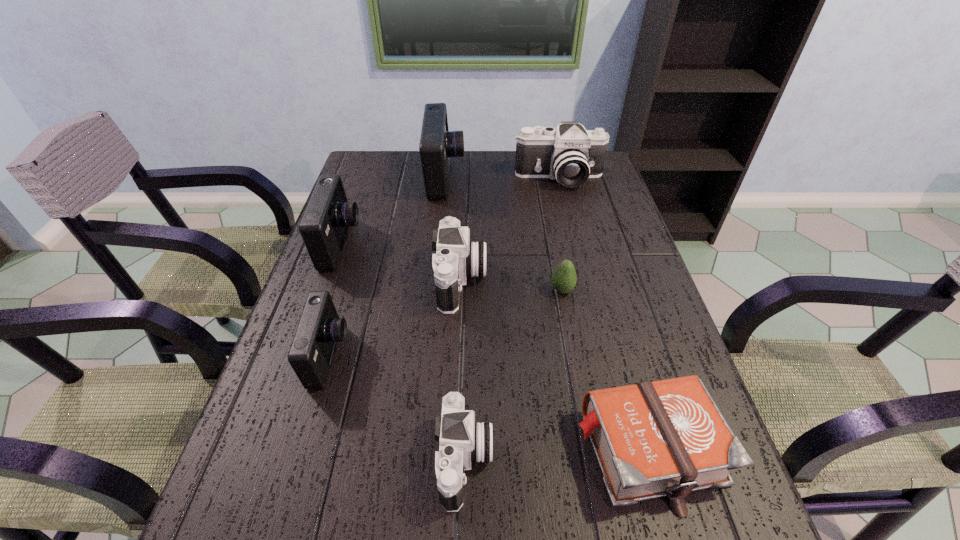
Locate an element on the screen. This screenshot has height=540, width=960. black camera that stands as the third closest to the avocado is located at coordinates (570, 154).

This screenshot has width=960, height=540. In order to click on free space that satisfies the following two spatial constraints: 1. on the front side of the rightmost camera; 2. on the front-facing side of the second smallest blue camera in this screenshot , I will do `click(574, 245)`.

Identify the location of vacant area that satisfies the following two spatial constraints: 1. on the front-facing side of the second biggest black camera; 2. on the left side of the second nearest blue camera. Image resolution: width=960 pixels, height=540 pixels. (328, 280).

Identify the location of vacant position in the image that satisfies the following two spatial constraints: 1. on the front-facing side of the second nearest blue camera; 2. on the back side of the second biggest black camera. (328, 280).

Where is `vacant space that satisfies the following two spatial constraints: 1. on the front-facing side of the biggest blue camera; 2. on the left side of the second farthest black camera`? The width and height of the screenshot is (960, 540). vacant space that satisfies the following two spatial constraints: 1. on the front-facing side of the biggest blue camera; 2. on the left side of the second farthest black camera is located at coordinates (434, 280).

Locate an element on the screen. The width and height of the screenshot is (960, 540). vacant region that satisfies the following two spatial constraints: 1. on the front side of the rightmost black camera; 2. on the front-facing side of the nearest blue camera is located at coordinates (601, 356).

You are a GUI agent. You are given a task and a screenshot of the screen. Output one action in this format:
    pyautogui.click(x=<x>, y=<y>)
    Task: Click on the free space that satisfies the following two spatial constraints: 1. on the front-facing side of the farthest blue camera; 2. on the right side of the Bible
    
    Given the screenshot: What is the action you would take?
    pyautogui.click(x=416, y=450)